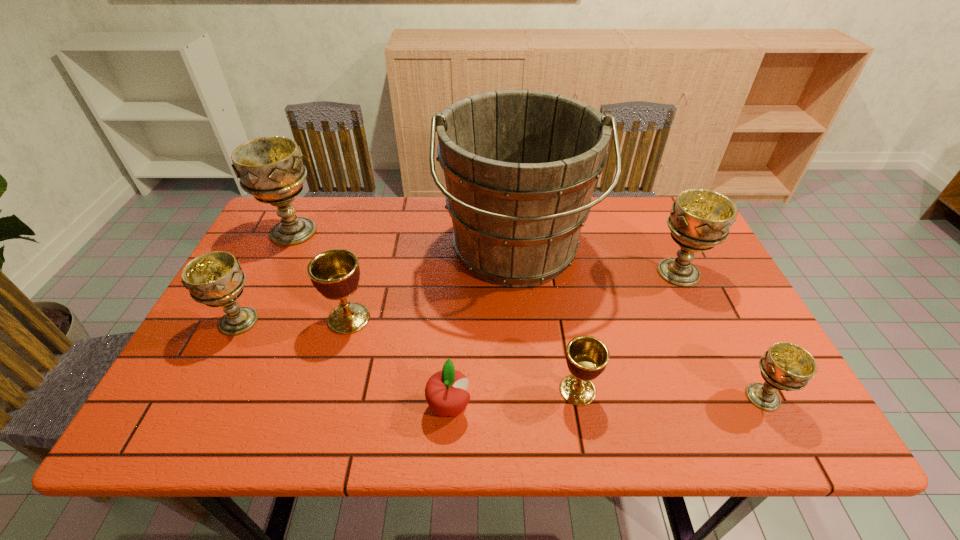
Find the location of a particular element. the smallest white chalice is located at coordinates (785, 366).

The height and width of the screenshot is (540, 960). Identify the location of apple. (445, 392).

The height and width of the screenshot is (540, 960). Identify the location of the shortest object. (445, 392).

You are a GUI agent. You are given a task and a screenshot of the screen. Output one action in this format:
    pyautogui.click(x=<x>, y=<y>)
    Task: Click on the blank space located on the handle side of the bucket
    The image size is (960, 540).
    Given the screenshot: What is the action you would take?
    pyautogui.click(x=529, y=418)

Find the location of a particular element. This screenshot has height=540, width=960. free space located 0.140m on the right of the farthest white chalice is located at coordinates (369, 232).

The width and height of the screenshot is (960, 540). Identify the location of free space located 0.170m on the front of the second biggest white chalice. (712, 343).

You are a GUI agent. You are given a task and a screenshot of the screen. Output one action in this format:
    pyautogui.click(x=<x>, y=<y>)
    Task: Click on the free location located 0.250m on the left of the third object from left to right
    
    Given the screenshot: What is the action you would take?
    pyautogui.click(x=226, y=319)

This screenshot has width=960, height=540. I want to click on free spot located 0.360m on the back of the third biggest white chalice, so click(x=291, y=219).

The height and width of the screenshot is (540, 960). Identify the location of free location located on the right of the third chalice from right to left. (761, 390).

In order to click on vacant space located 0.230m on the left of the smallest white chalice in this screenshot , I will do `click(634, 397)`.